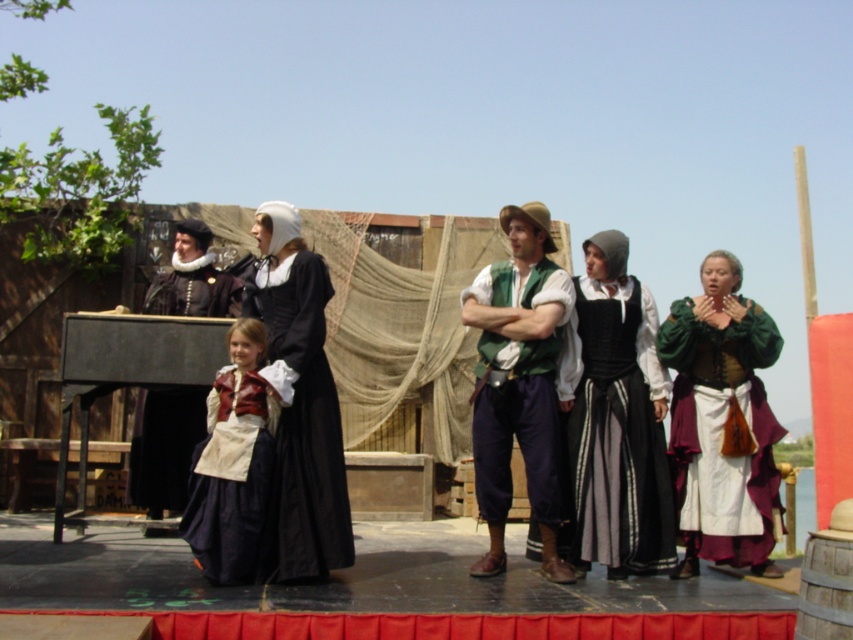
Question: Can you confirm if black velvet dress at center is wider than matte black dress at left?

Choices:
 (A) yes
 (B) no

Answer: (A)

Question: Is black velvet dress at center in front of green fabric vest at center?

Choices:
 (A) no
 (B) yes

Answer: (A)

Question: Which object is closer to the camera taking this photo?

Choices:
 (A) matte black dress at left
 (B) green fabric vest at center

Answer: (B)

Question: Which object appears closest to the camera in this image?

Choices:
 (A) matte black dress at center
 (B) green fabric vest at center
 (C) green velvet dress at center
 (D) matte red dress at center

Answer: (D)

Question: Can you confirm if green fabric vest at center is wider than matte red dress at center?

Choices:
 (A) no
 (B) yes

Answer: (B)

Question: Which object is farther from the camera taking this photo?

Choices:
 (A) matte red dress at center
 (B) matte black dress at left

Answer: (B)